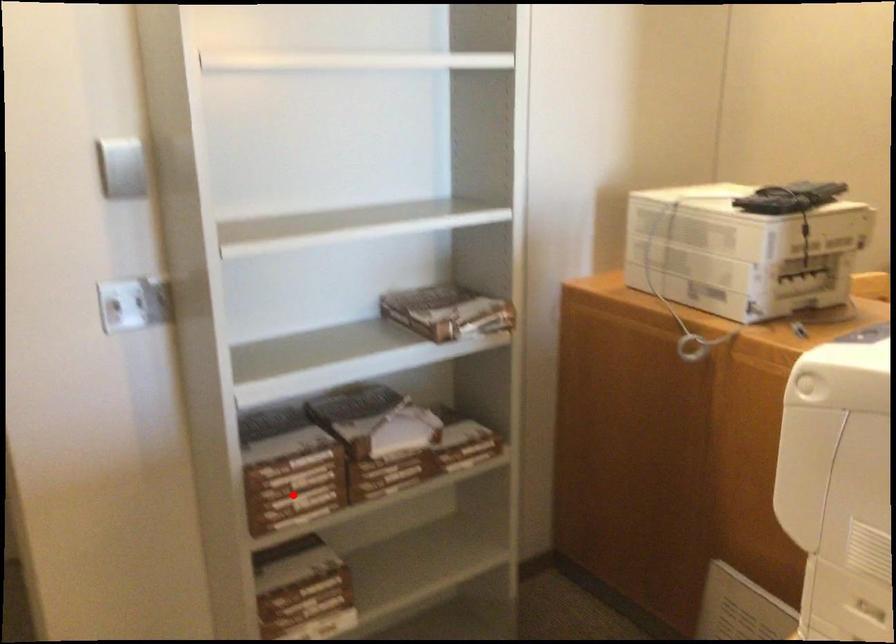
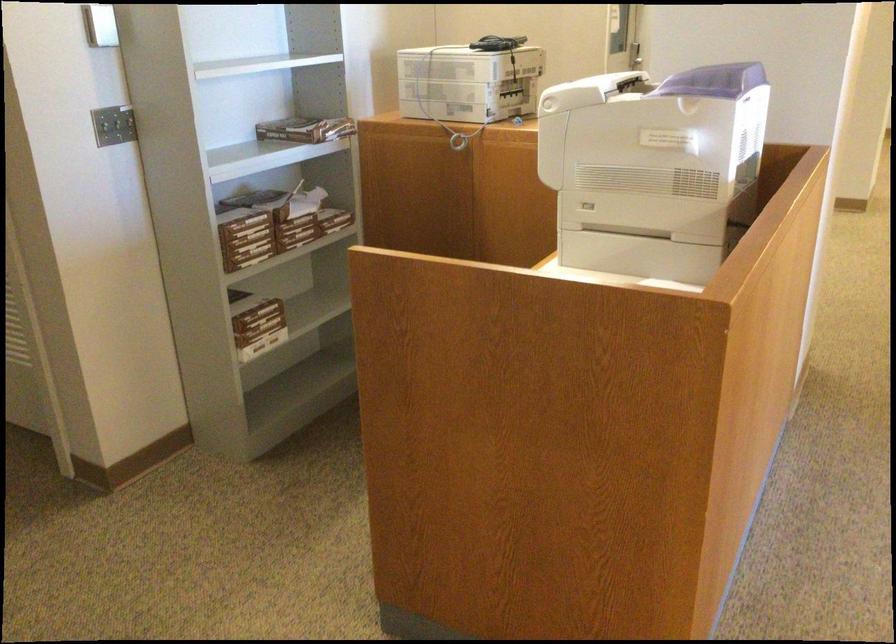
Question: I am providing you with two images of the same scene from different viewpoints. Given a red point in image1, look at the same physical point in image2. Is it:

Choices:
 (A) Closer to the viewpoint
 (B) Farther from the viewpoint

Answer: (B)